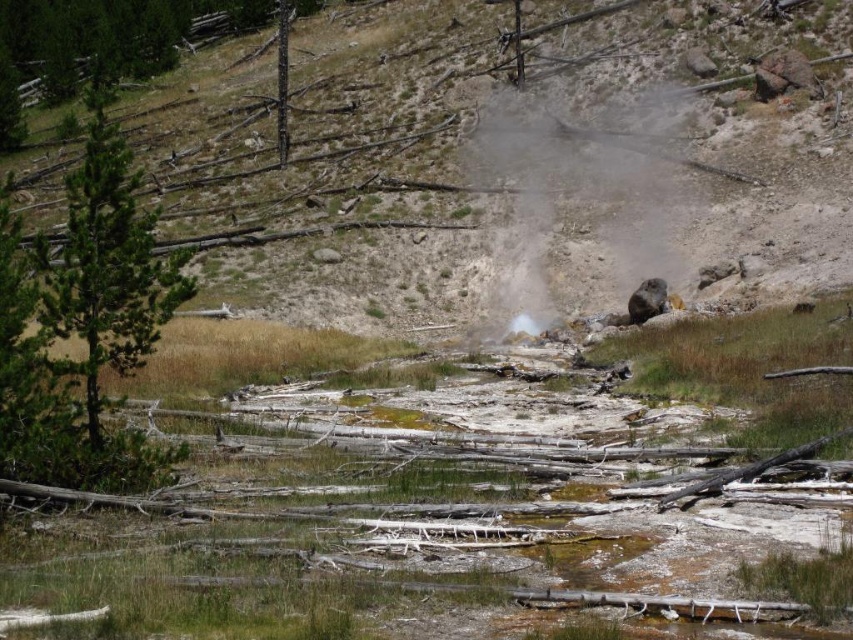
Question: Does gray dusty rock at center lie behind green textured pine tree at left?

Choices:
 (A) yes
 (B) no

Answer: (A)

Question: Considering the real-world distances, which object is farthest from the green textured pine tree at left?

Choices:
 (A) brown dirt hillside at center
 (B) gray dusty rock at center

Answer: (B)

Question: Which point is closer to the camera?

Choices:
 (A) green textured pine tree at left
 (B) brown dirt hillside at center
 (C) gray dusty rock at center

Answer: (A)

Question: Among these objects, which one is farthest from the camera?

Choices:
 (A) brown dirt hillside at center
 (B) green textured pine tree at left
 (C) gray dusty rock at center

Answer: (C)

Question: Does gray dusty rock at center have a larger size compared to green textured pine tree at left?

Choices:
 (A) yes
 (B) no

Answer: (B)

Question: Where is gray dusty rock at center located in relation to green textured pine tree at left in the image?

Choices:
 (A) right
 (B) left

Answer: (A)